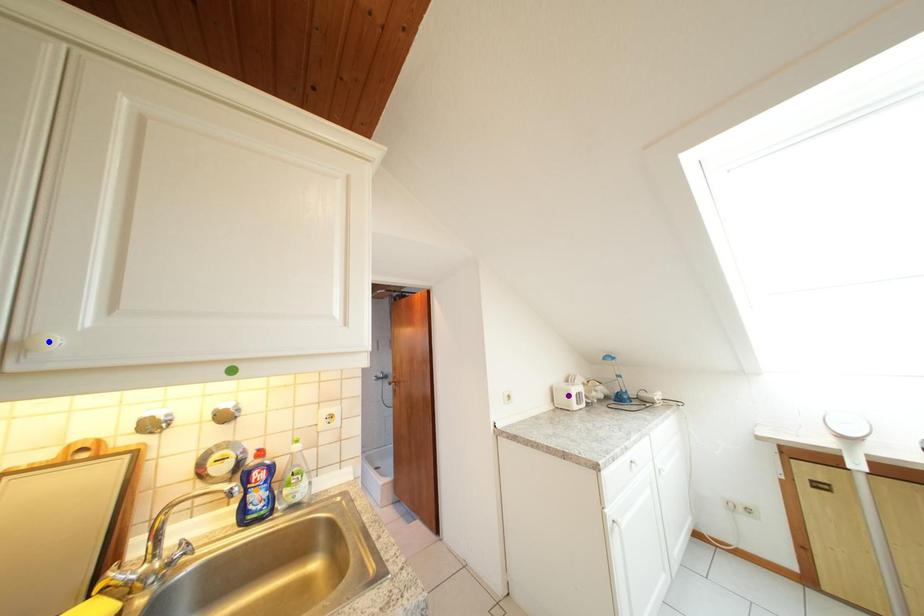
Order these from nearest to farthest:
1. purple point
2. blue point
3. orange point

purple point < orange point < blue point